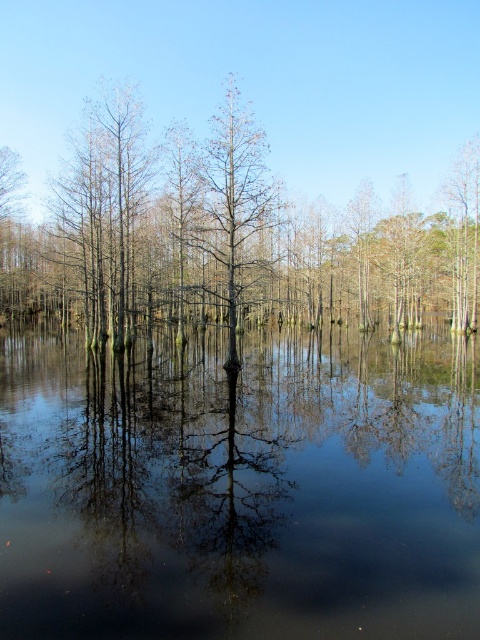
Can you confirm if transparent water at center is wider than brown matte tree at center?

Incorrect, transparent water at center's width does not surpass brown matte tree at center's.

Is transparent water at center positioned in front of brown matte tree at center?

Yes.

Measure the distance between transparent water at center and camera.

transparent water at center is 4.62 meters from camera.

Locate an element on the screen. The image size is (480, 640). transparent water at center is located at coordinates (240, 484).